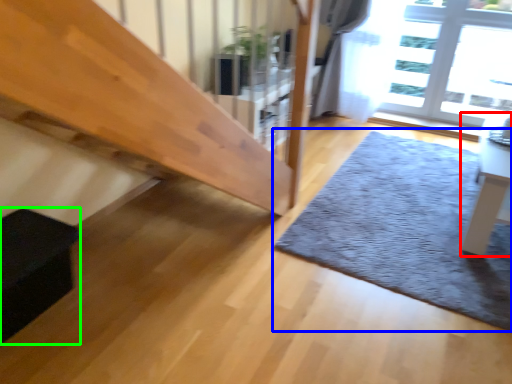
Question: Which object is the closest to the table (highlighted by a red box)? Choose among these: mat (highlighted by a blue box) or furniture (highlighted by a green box).

Choices:
 (A) mat
 (B) furniture

Answer: (A)